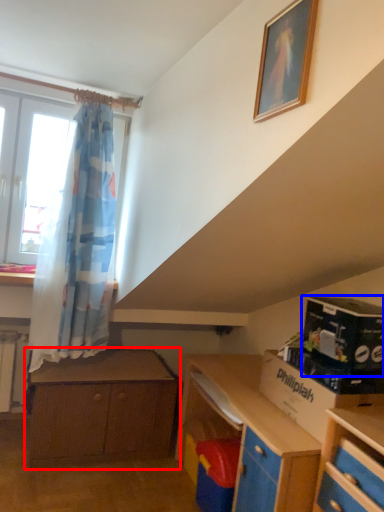
Question: Which point is closer to the camera, chest of drawers (highlighted by a red box) or box (highlighted by a blue box)?

Choices:
 (A) chest of drawers
 (B) box

Answer: (B)